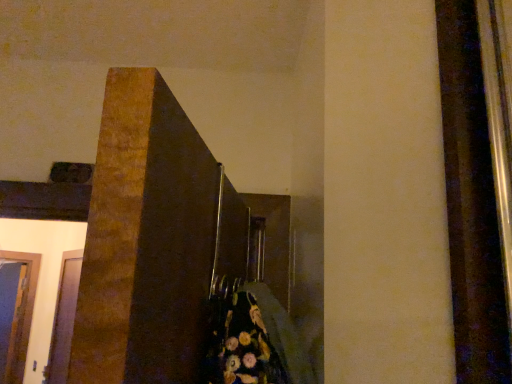
Question: Does point (67, 263) appear closer or farther from the camera than point (13, 296)?

Choices:
 (A) farther
 (B) closer

Answer: (B)

Question: Would you say transparent glass door at lower left, positioned as the second glass door in left-to-right order, is inside or outside transparent glass door at lower left, the first glass door when ordered from back to front?

Choices:
 (A) outside
 (B) inside

Answer: (A)

Question: Considering their positions, is transparent glass door at lower left, which is the first glass door in front-to-back order, located in front of or behind transparent glass door at lower left, which is the second glass door from right to left?

Choices:
 (A) behind
 (B) front

Answer: (B)

Question: From a real-world perspective, is transparent glass door at lower left, the first glass door when ordered from back to front, above or below transparent glass door at lower left, positioned as the second glass door in left-to-right order?

Choices:
 (A) above
 (B) below

Answer: (A)

Question: Is point tap(15, 380) positioned closer to the camera than point tap(49, 354)?

Choices:
 (A) farther
 (B) closer

Answer: (A)

Question: From their relative heights in the image, would you say transparent glass door at lower left, the first glass door when ordered from back to front, is taller or shorter than transparent glass door at lower left, which is the first glass door from right to left?

Choices:
 (A) short
 (B) tall

Answer: (B)

Question: Is transparent glass door at lower left, placed as the 2th glass door when sorted from front to back, in front of or behind transparent glass door at lower left, which ranks as the 2th glass door in back-to-front order, in the image?

Choices:
 (A) behind
 (B) front

Answer: (A)